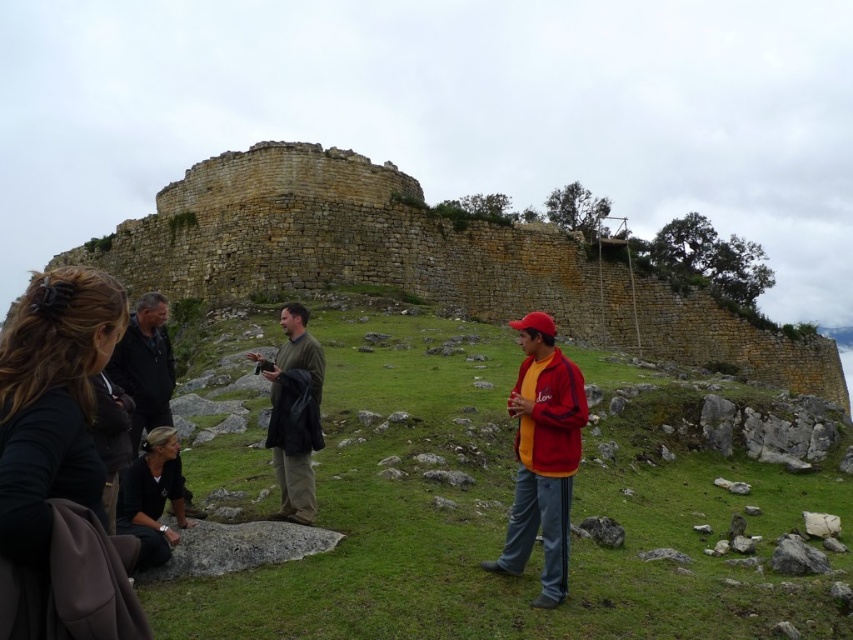
Between black fabric bag at lower left and matte red jacket at center, which one appears on the right side from the viewer's perspective?

matte red jacket at center is more to the right.

You are a GUI agent. You are given a task and a screenshot of the screen. Output one action in this format:
    pyautogui.click(x=<x>, y=<y>)
    Task: Click on the black fabric bag at lower left
    This screenshot has height=640, width=853.
    Given the screenshot: What is the action you would take?
    pyautogui.click(x=59, y=467)

Is black fabric bag at lower left wider than black fabric shirt at lower left?

Correct, the width of black fabric bag at lower left exceeds that of black fabric shirt at lower left.

Between point (51, 582) and point (154, 444), which one is positioned behind?

Positioned behind is point (154, 444).

Measure the distance between black fabric bag at lower left and camera.

They are 24.84 meters apart.

Identify the location of black fabric bag at lower left. (59, 467).

Which is in front, point (701, 298) or point (10, 406)?

Point (10, 406) is in front.

Is yellow stone wall at upper center smaller than black fabric bag at lower left?

Actually, yellow stone wall at upper center might be larger than black fabric bag at lower left.

Is point (439, 266) less distant than point (113, 589)?

No, it is not.

This screenshot has width=853, height=640. What are the coordinates of `yellow stone wall at upper center` in the screenshot? It's located at (421, 260).